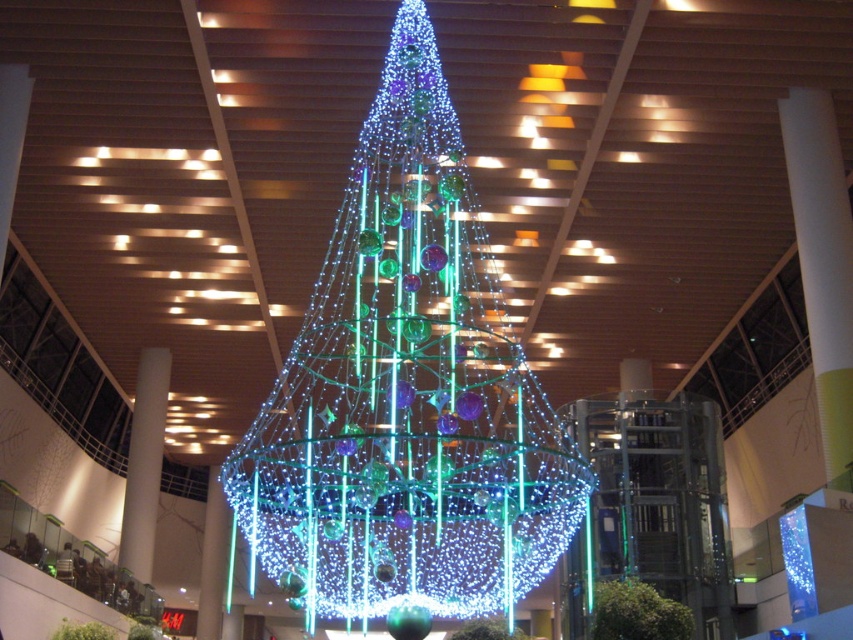
Can you confirm if illuminated glass christmas tree at center is smaller than iridescent glass ornaments at center?

Incorrect, illuminated glass christmas tree at center is not smaller in size than iridescent glass ornaments at center.

Does illuminated glass christmas tree at center have a greater height compared to iridescent glass ornaments at center?

Yes.

Is point (444, 468) less distant than point (608, 588)?

Yes, point (444, 468) is in front of point (608, 588).

What are the coordinates of `illuminated glass christmas tree at center` in the screenshot? It's located at (405, 396).